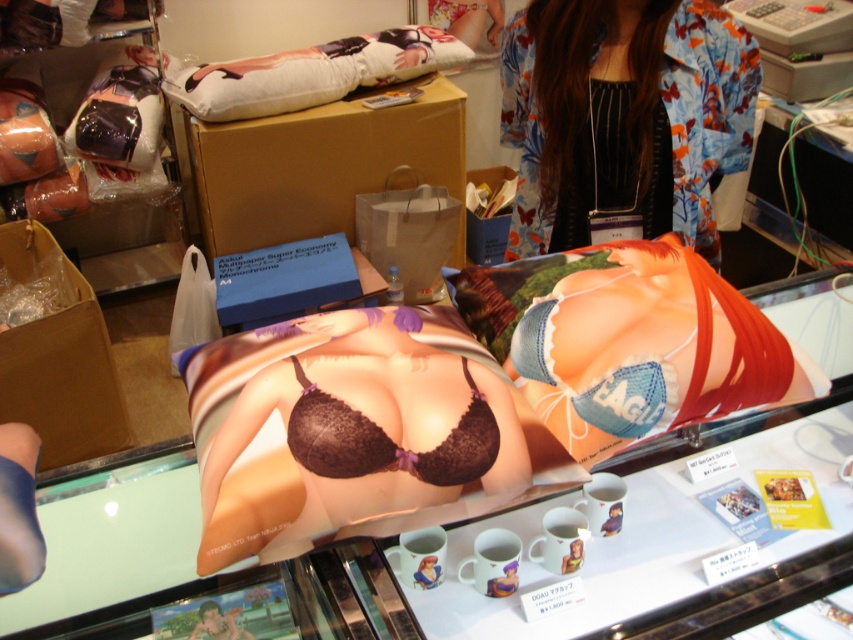
You are a customer standing in front of the retail display. You notice two points on the glass counter where the pillows are displayed. The first point is at coordinates point (743, 81) and the second is at point (370, 426). Which of these points is closer to you?

Point (743, 81) is further to the camera than point (370, 426), so the point closer to you is point (370, 426).

You are standing in front of the retail display and want to locate the floral kimono at upper center. Based on the coordinates provided, can you determine its exact position relative to the pillows and mugs displayed?

The floral kimono at upper center is located at coordinates point (x=624, y=116), which places it above the pillows and mugs displayed on the glass counter.